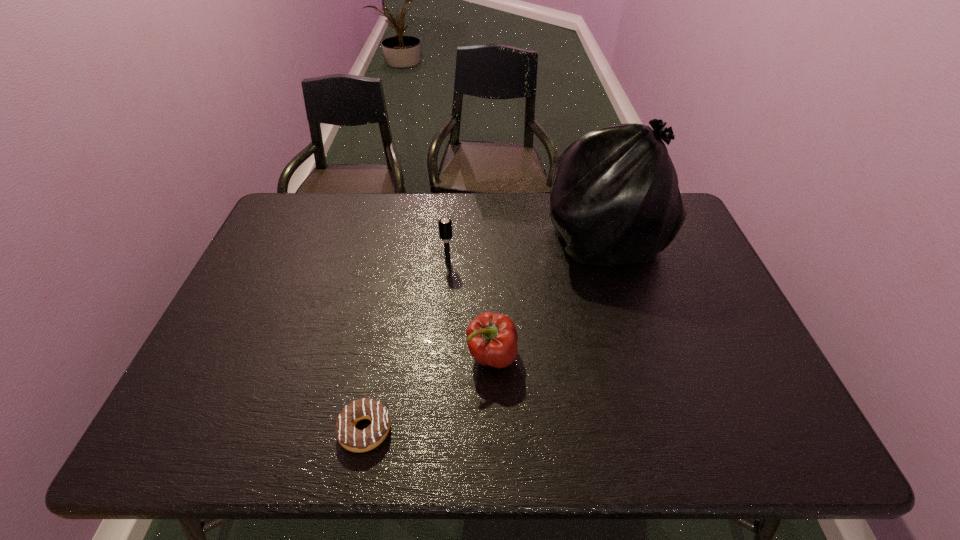
The image size is (960, 540). I want to click on free space at the far left corner, so click(310, 219).

Where is `vacant space that's between the shortest object and the third shortest object`? The image size is (960, 540). vacant space that's between the shortest object and the third shortest object is located at coordinates (406, 346).

Find the location of a particular element. The width and height of the screenshot is (960, 540). free space between the shortest object and the second object from right to left is located at coordinates (428, 393).

Identify the location of free space that is in between the bell pepper and the plastic bag. (547, 297).

This screenshot has width=960, height=540. Identify the location of free point between the leftmost object and the second tallest object. (406, 346).

Find the location of a particular element. The height and width of the screenshot is (540, 960). vacant area that lies between the second object from left to right and the nearest object is located at coordinates (406, 346).

The width and height of the screenshot is (960, 540). I want to click on vacant area between the rightmost object and the second shortest object, so click(x=547, y=297).

Identify which object is the second nearest to the bell pepper. Please provide its 2D coordinates. Your answer should be formatted as a tuple, i.e. [(x, y)], where the tuple contains the x and y coordinates of a point satisfying the conditions above.

[(615, 199)]

Where is `object that is the second closest one to the nearest object`? object that is the second closest one to the nearest object is located at coordinates (445, 228).

Identify the location of free location that satisfies the following two spatial constraints: 1. on the back side of the doughnut; 2. on the right side of the bell pepper. (379, 356).